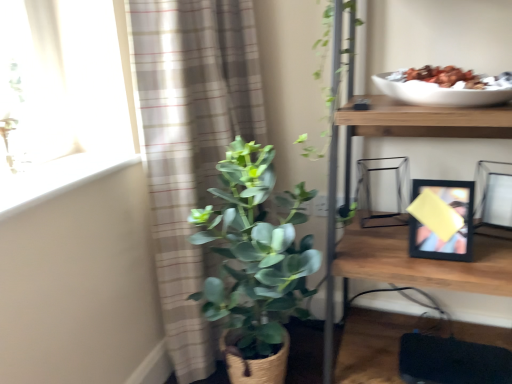
The height and width of the screenshot is (384, 512). In order to click on free location above white smooth window sill at upper left (from a real-world perspective) in this screenshot , I will do `click(53, 172)`.